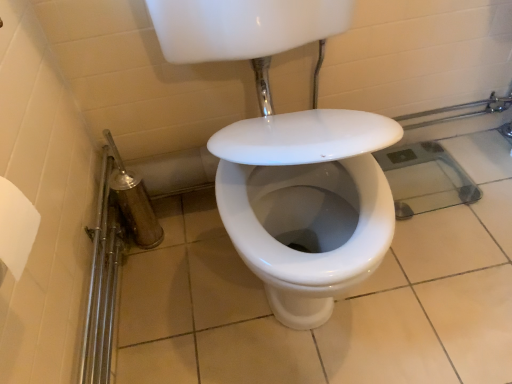
Question: Does white glossy sink at center have a smaller size compared to shiny metallic shower at lower left?

Choices:
 (A) no
 (B) yes

Answer: (A)

Question: From the image's perspective, does white glossy sink at center appear lower than shiny metallic shower at lower left?

Choices:
 (A) yes
 (B) no

Answer: (B)

Question: Is the position of white glossy sink at center more distant than that of shiny metallic shower at lower left?

Choices:
 (A) no
 (B) yes

Answer: (A)

Question: Is white glossy sink at center thinner than shiny metallic shower at lower left?

Choices:
 (A) yes
 (B) no

Answer: (B)

Question: Considering the relative sizes of white glossy sink at center and shiny metallic shower at lower left in the image provided, is white glossy sink at center taller than shiny metallic shower at lower left?

Choices:
 (A) yes
 (B) no

Answer: (A)

Question: Considering the relative sizes of white glossy sink at center and shiny metallic shower at lower left in the image provided, is white glossy sink at center wider than shiny metallic shower at lower left?

Choices:
 (A) yes
 (B) no

Answer: (A)

Question: From a real-world perspective, does shiny metallic shower at lower left stand above white glossy sink at center?

Choices:
 (A) no
 (B) yes

Answer: (A)

Question: From the image's perspective, is shiny metallic shower at lower left under white glossy sink at center?

Choices:
 (A) yes
 (B) no

Answer: (A)

Question: Considering the relative sizes of shiny metallic shower at lower left and white glossy sink at center in the image provided, is shiny metallic shower at lower left thinner than white glossy sink at center?

Choices:
 (A) yes
 (B) no

Answer: (A)

Question: Is shiny metallic shower at lower left smaller than white glossy sink at center?

Choices:
 (A) yes
 (B) no

Answer: (A)

Question: Is shiny metallic shower at lower left completely or partially outside of white glossy sink at center?

Choices:
 (A) yes
 (B) no

Answer: (A)

Question: From the image's perspective, is shiny metallic shower at lower left on top of white glossy sink at center?

Choices:
 (A) yes
 (B) no

Answer: (B)

Question: Considering the positions of point (138, 205) and point (229, 3), is point (138, 205) closer or farther from the camera than point (229, 3)?

Choices:
 (A) farther
 (B) closer

Answer: (A)